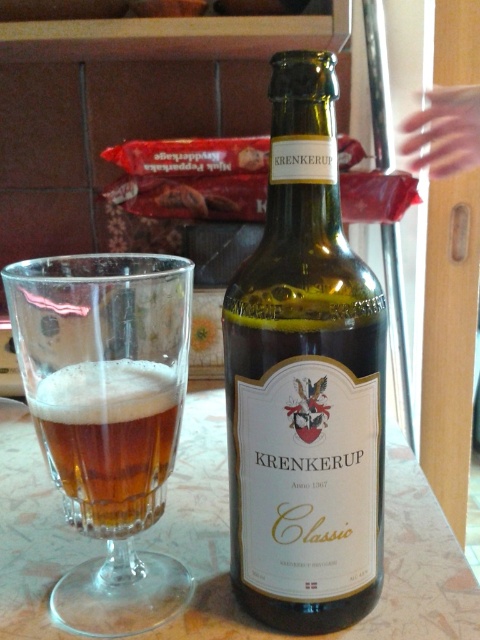
You are at a bar and want to pour the beer from the green glass bottle at center into the transparent glass at center. Which direction should you move the bottle to align it with the glass?

The green glass bottle at center is positioned on the right side of transparent glass at center, so you should move the bottle to the left to align it with the glass.

In the scene shown: You are a bartender preparing a drink and need to place the transparent glass at center exactly at coordinate point 0.655, 0.225. Where should you position it?

You should position the transparent glass at center at the coordinate point (108, 419).

You are a bartender trying to arrange two items on a shelf. The green glass bottle at center and the amber glass beer at center must be placed such that they are at least 4 inches apart. Based on their current positions, can you place them as required?

The green glass bottle at center is currently 3.15 inches from the amber glass beer at center, which is less than the required 4 inches. Therefore, you need to move them further apart to meet the spacing requirement.